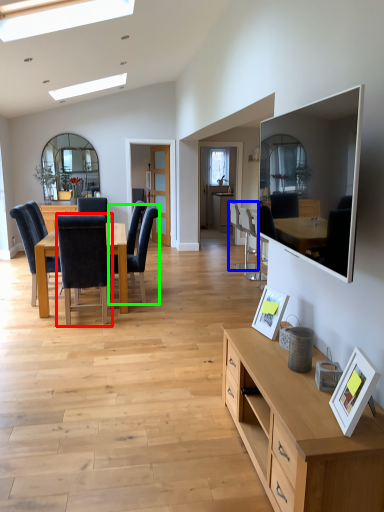
Question: Estimate the real-world distances between objects in this image. Which object is closer to chair (highlighted by a red box), chair (highlighted by a blue box) or chair (highlighted by a green box)?

Choices:
 (A) chair
 (B) chair

Answer: (B)